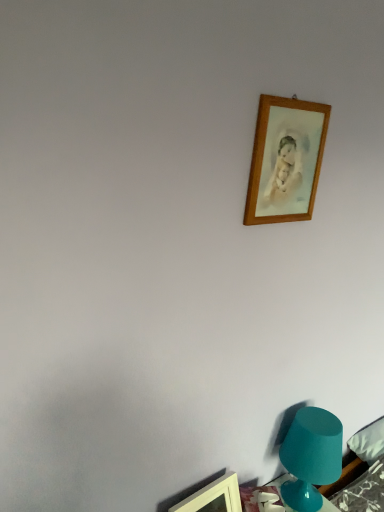
Question: Considering the positions of wooden picture frame at upper right, which ranks as the second picture frame in left-to-right order, and wooden picture frame at upper right, placed as the 1th picture frame when sorted from left to right, in the image, is wooden picture frame at upper right, which ranks as the second picture frame in left-to-right order, taller or shorter than wooden picture frame at upper right, placed as the 1th picture frame when sorted from left to right,?

Choices:
 (A) tall
 (B) short

Answer: (A)

Question: From the image's perspective, is wooden picture frame at upper right, acting as the first picture frame starting from the top, positioned above or below wooden picture frame at upper right, positioned as the 2th picture frame in right-to-left order?

Choices:
 (A) below
 (B) above

Answer: (B)

Question: Based on their relative distances, which object is farther from the teal glass lamp at lower right?

Choices:
 (A) wooden picture frame at upper right, which ranks as the second picture frame in left-to-right order
 (B) wooden picture frame at upper right, placed as the 1th picture frame when sorted from left to right

Answer: (A)

Question: Which is nearer to the wooden picture frame at upper right, which ranks as the 1th picture frame in bottom-to-top order?

Choices:
 (A) wooden picture frame at upper right, which ranks as the 1th picture frame in right-to-left order
 (B) teal glass lamp at lower right

Answer: (B)